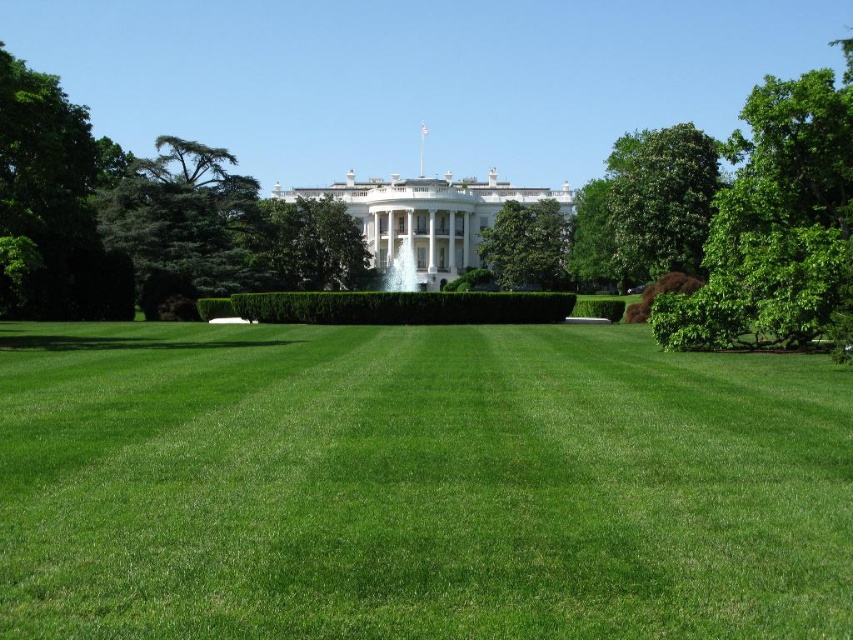
Question: Which is nearer to the brown textured hedge at right?

Choices:
 (A) green leafy tree at center
 (B) green leafy tree at right
 (C) green leafy hedge at center

Answer: (B)

Question: Is green leafy tree at right to the right of green needle-like tree at left from the viewer's perspective?

Choices:
 (A) yes
 (B) no

Answer: (A)

Question: Which point is closer to the camera?

Choices:
 (A) green leafy tree at right
 (B) green leafy tree at upper left
 (C) green leafy tree at center

Answer: (A)

Question: Is green needle-like tree at left above green leafy tree at center?

Choices:
 (A) yes
 (B) no

Answer: (B)

Question: Which object is closer to the camera taking this photo?

Choices:
 (A) brown textured hedge at right
 (B) green leafy hedge at center
 (C) green leafy tree at center

Answer: (A)

Question: Where is green needle-like tree at left located in relation to green leafy tree at center in the image?

Choices:
 (A) above
 (B) below

Answer: (B)